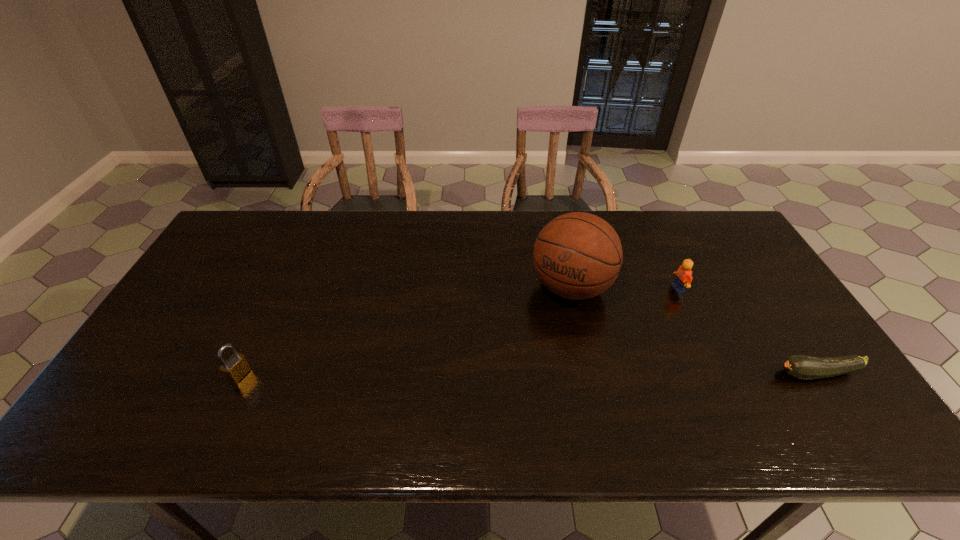
Find the location of `free point between the basketball and the leftmost object`. free point between the basketball and the leftmost object is located at coordinates (405, 331).

Find the location of a particular element. This screenshot has width=960, height=540. free space between the padlock and the third object from left to right is located at coordinates click(459, 332).

This screenshot has height=540, width=960. Identify the location of free area in between the second object from left to right and the leftmost object. (405, 331).

This screenshot has width=960, height=540. What are the coordinates of `empty space between the zucchini and the tallest object` in the screenshot? It's located at click(694, 330).

You are a GUI agent. You are given a task and a screenshot of the screen. Output one action in this format:
    pyautogui.click(x=<x>, y=<y>)
    Task: Click on the free space between the rightmost object and the leftmost object
    
    Given the screenshot: What is the action you would take?
    pyautogui.click(x=529, y=374)

I want to click on the second closest object to the rightmost object, so click(577, 255).

Image resolution: width=960 pixels, height=540 pixels. What are the coordinates of `the closest object to the zucchini` in the screenshot? It's located at (683, 278).

I want to click on free spot that satisfies the following two spatial constraints: 1. on the back side of the third object from left to right; 2. on the right side of the leftmost object, so click(x=280, y=289).

Find the location of `vacant space that satisfies the following two spatial constraints: 1. on the back side of the zucchini; 2. at the blossom end of the padlock`. vacant space that satisfies the following two spatial constraints: 1. on the back side of the zucchini; 2. at the blossom end of the padlock is located at coordinates (240, 374).

The image size is (960, 540). I want to click on free space that satisfies the following two spatial constraints: 1. on the front side of the zucchini; 2. at the blossom end of the second object from right to left, so click(x=718, y=374).